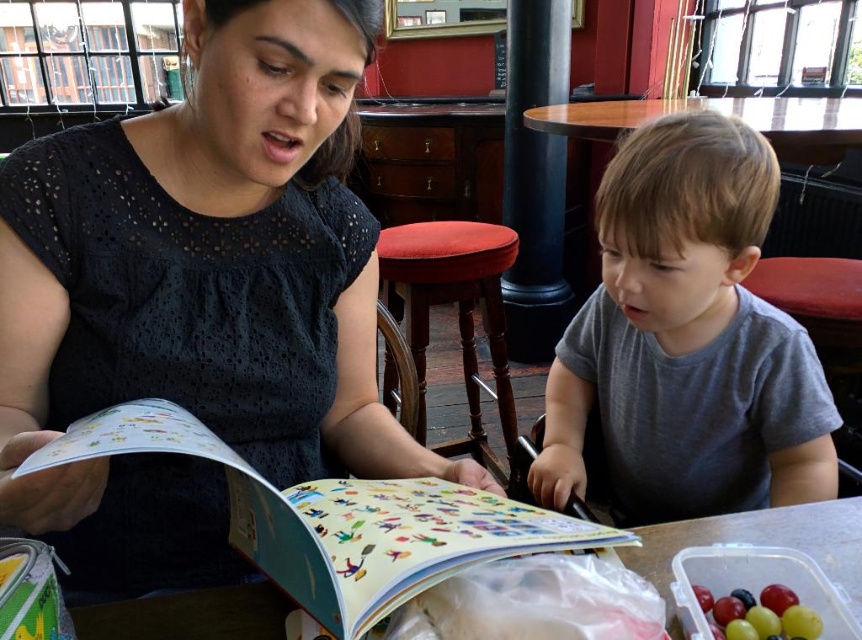
Question: Is red fabric stool at center thinner than glossy plastic container of grapes at lower right?

Choices:
 (A) yes
 (B) no

Answer: (B)

Question: Can you confirm if red fabric stool at center is smaller than red leather stool at right?

Choices:
 (A) no
 (B) yes

Answer: (A)

Question: Which object is positioned closest to the red leather stool at right?

Choices:
 (A) matte paper book at center
 (B) glossy plastic container of grapes at lower right

Answer: (A)

Question: Can you confirm if white plastic table at center is bigger than red fabric stool at center?

Choices:
 (A) no
 (B) yes

Answer: (A)

Question: Which object appears farthest from the camera in this image?

Choices:
 (A) red leather stool at right
 (B) matte paper book at center

Answer: (A)

Question: Which of the following is the farthest from the observer?

Choices:
 (A) red leather stool at right
 (B) gray cotton shirt at center
 (C) black polished wood pillar at center
 (D) glossy plastic container of grapes at lower right

Answer: (C)